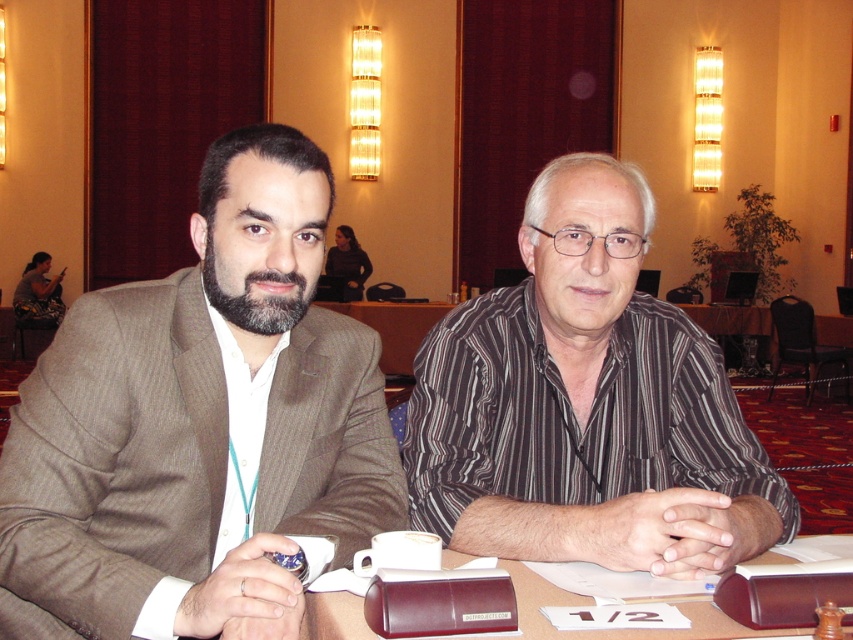
You are a photographer standing in front of the table. You need to place a new camera on the table between the brown pinstripe suit at left and the brown leather folder at center. Where should you place the camera?

The camera should be placed between the brown pinstripe suit at left and the brown leather folder at center, to the right of the brown pinstripe suit at left since it is positioned to the left of the brown leather folder at center.

You are a photographer who needs to capture a clear shot of both the striped cotton shirt at center and the brown leather folder at center. Since both are at the center, how can you position your camera to ensure both are in frame?

The striped cotton shirt at center is to the right of the brown leather folder at center, so position the camera slightly to the left of the folder to include both objects in the frame.